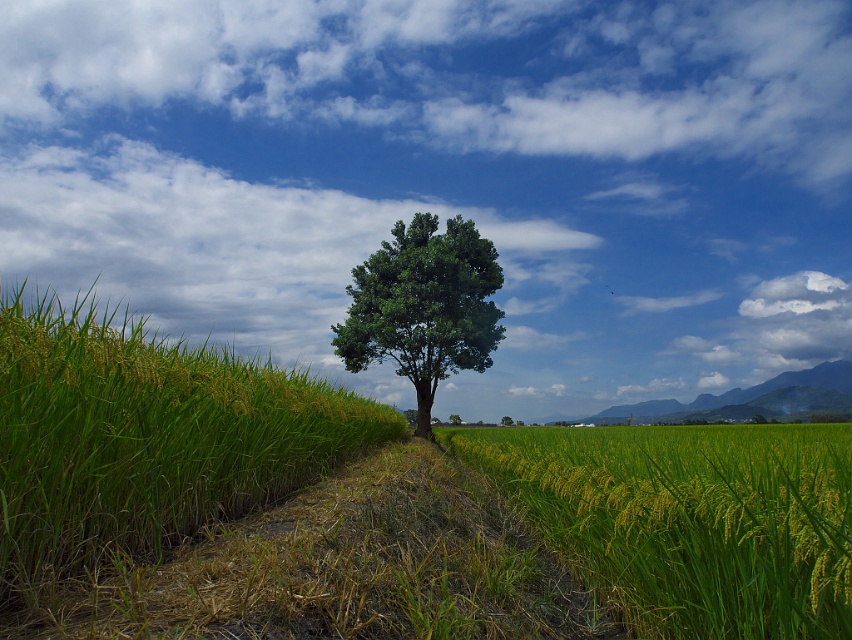
You are a farmer planning to plant a new row of crops between the green matte wheat field at center and the green leafy tree at center. Which side of the tree should you plant the new row to maintain alignment with the existing fields?

The green matte wheat field at center is positioned on the right side of green leafy tree at center, so you should plant the new row on the right side of the tree to maintain alignment with the existing fields.

You are standing at the edge of the rice field and see the green leafy tree at center. If you walk straight towards the tree, how far will you have to walk to reach it?

The distance between you and the green leafy tree at center is 31.26 meters, so you will have to walk 31.26 meters to reach it.